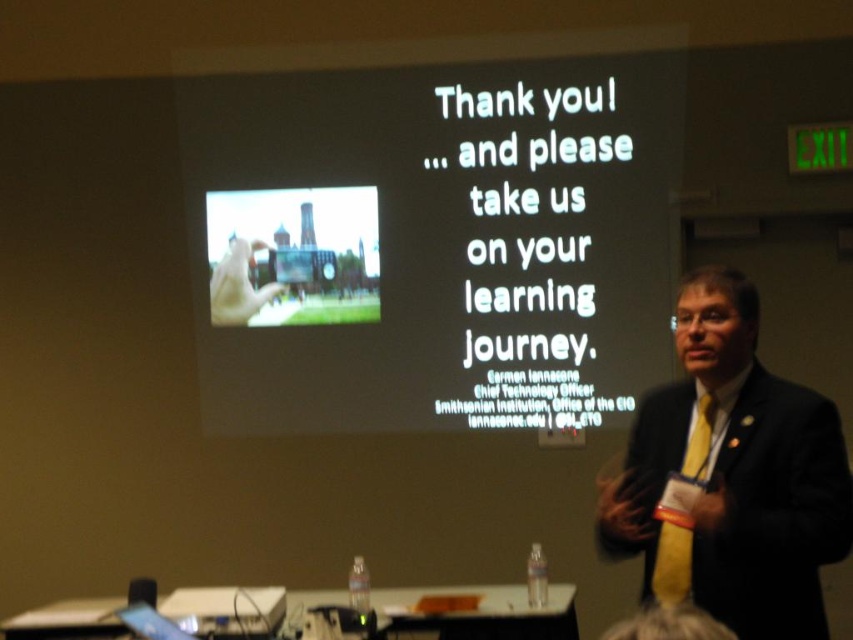
You are an event planner preparing for a virtual conference. You need to decide which device to use for live streaming the presentation. The white matte projector screen at upper center and the matte plastic phone at center are both available. Which device has a bigger screen for better visibility during the live stream?

The white matte projector screen at upper center has a larger size compared to the matte plastic phone at center, so it is better for better visibility during the live stream.

You are an event organizer who needs to arrange a photo shoot for the presenter. The photographer wants to ensure that both the black suit at center and the yellowtextured fabrictie at right are clearly visible in the photo. Based on their positions, which object should be positioned closer to the camera to maintain clarity?

The black suit at center should be positioned closer to the camera since it is already closer to the viewer than the yellowtextured fabrictie at right, ensuring both remain clearly visible.

You are an attendee at the presentation and want to record the speaker using your matte plastic phone at center. The speaker is standing at position point (292, 256). Is your phone positioned to capture the speaker clearly?

The point (292, 256) marks the matte plastic phone at center, so yes, the phone is positioned at the center to capture the speaker clearly.